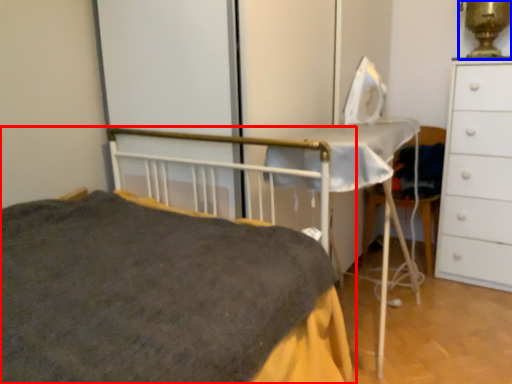
Question: Which point is closer to the camera, bed (highlighted by a red box) or table lamp (highlighted by a blue box)?

Choices:
 (A) bed
 (B) table lamp

Answer: (A)